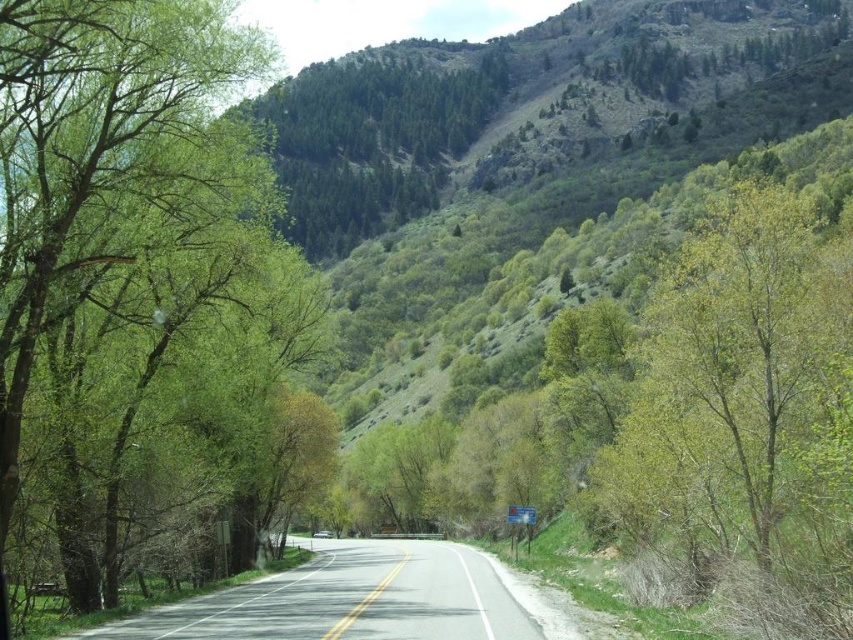
You are a delivery truck driver who needs to navigate a narrow mountain road. You see a green leafy tree at left and a gray asphalt road at center. Can your truck, which is 3 meters wide, safely pass through the space between them without hitting either?

The distance between the green leafy tree at left and the gray asphalt road at center is 10.68 meters. Since the truck is only 3 meters wide, there is ample space for it to pass safely without any collision.

You are a driver approaching the green leafy tree at left and the gray asphalt road at center. Which one appears narrower from your perspective?

The green leafy tree at left has a lesser width compared to the gray asphalt road at center, so the green leafy tree at left appears narrower.

You are driving a car and need to park it on the gray asphalt road at center. However, there is a green leafy tree at left nearby. Will the tree block the parking space?

The green leafy tree at left is positioned over the gray asphalt road at center, so it will block the parking space.